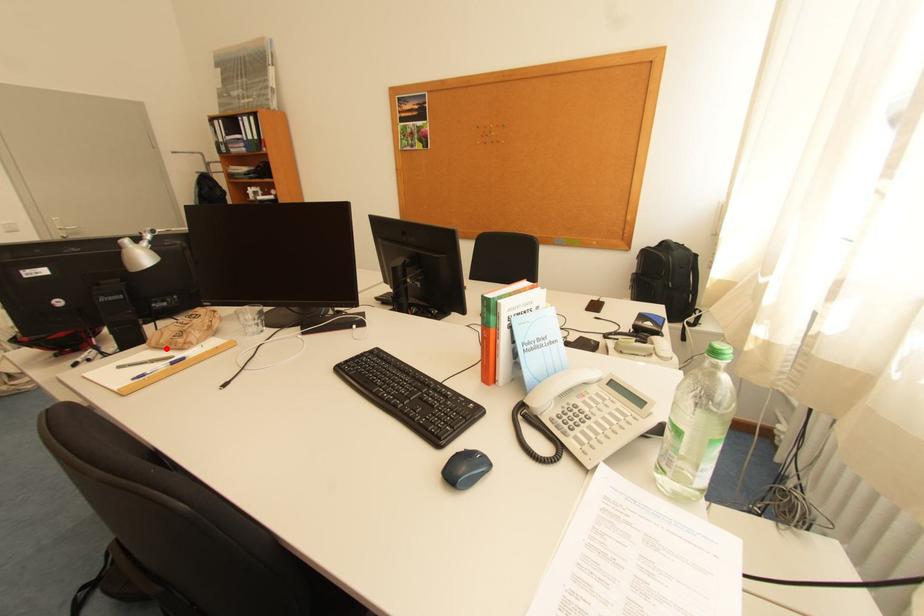
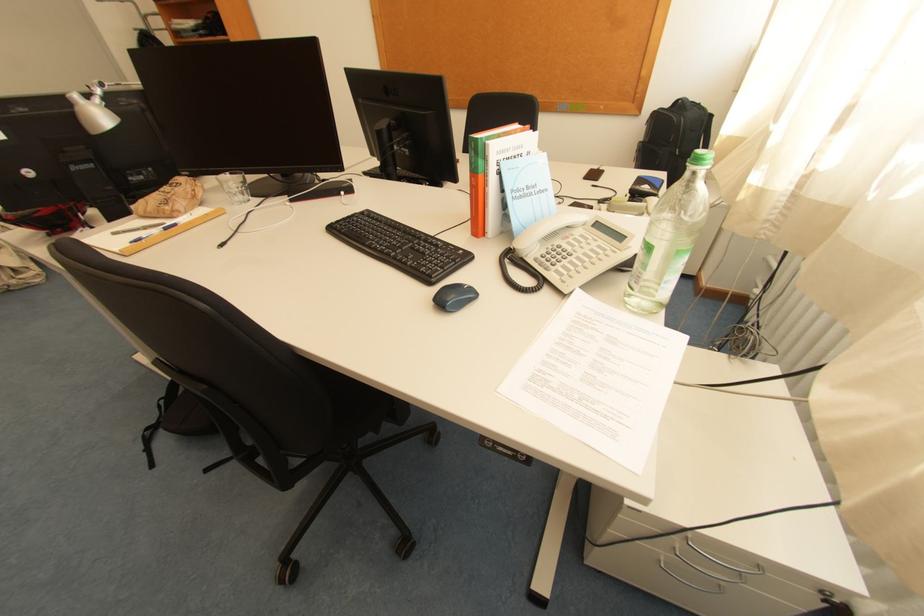
Locate, in the second image, the point that corresponds to the highlighted location in the first image.

(155, 217)